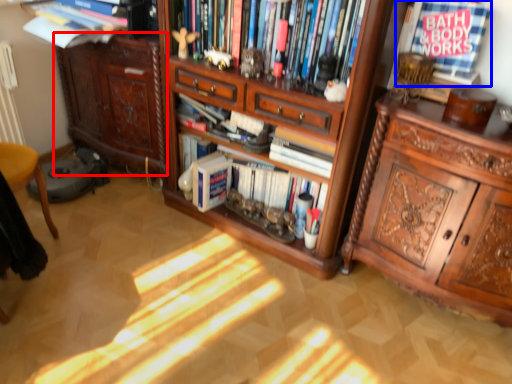
Question: Among these objects, which one is nearest to the camera, cabinetry (highlighted by a red box) or book (highlighted by a blue box)?

Choices:
 (A) cabinetry
 (B) book

Answer: (B)